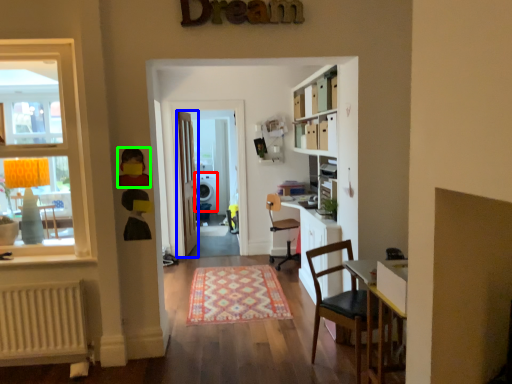
Question: Considering the real-world distances, which object is closest to loudspeaker (highlighted by a red box)? door (highlighted by a blue box) or toy (highlighted by a green box).

Choices:
 (A) door
 (B) toy

Answer: (A)